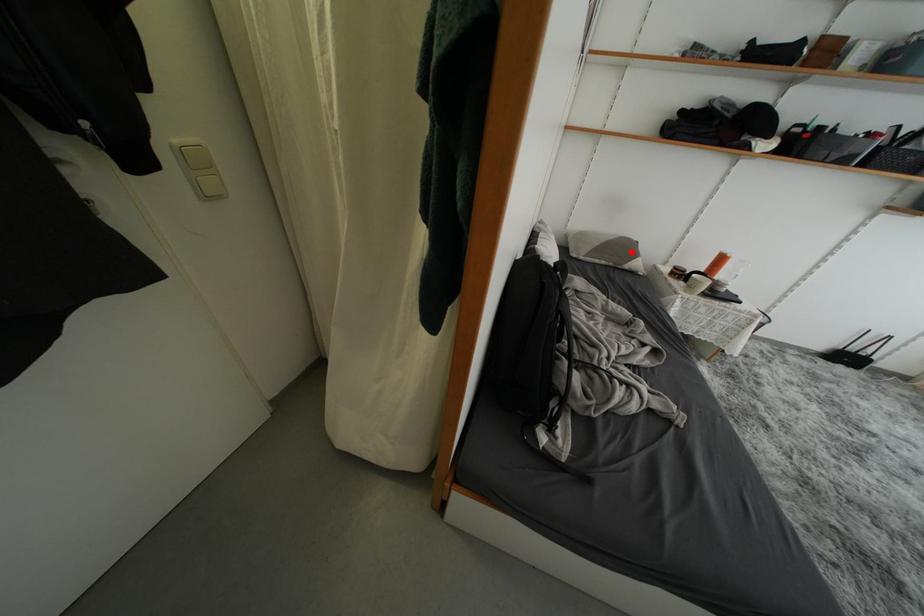
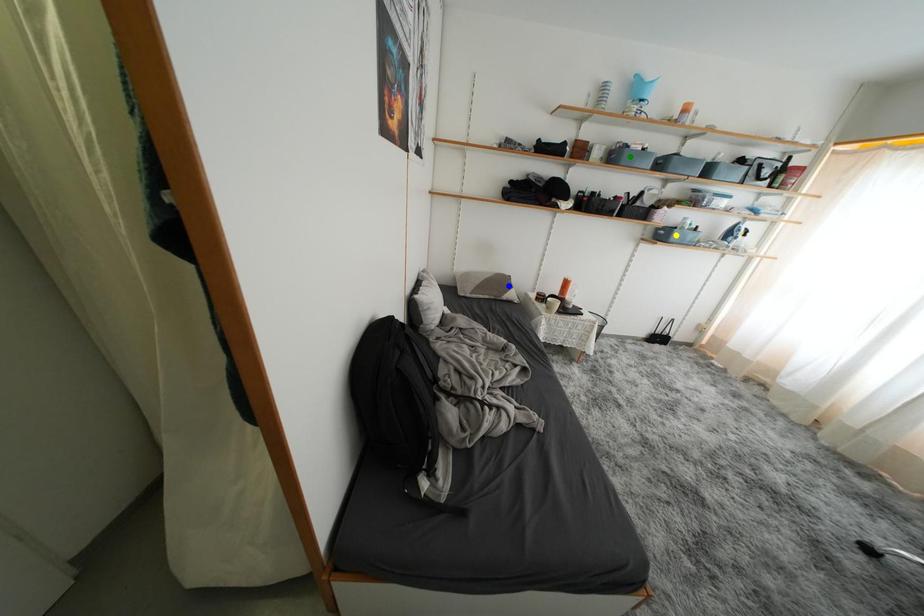
Question: I am providing you with two images of the same scene from different viewpoints. A red point is marked on the first image. You are given multiple points on the second image. Can you choose the point in image 2 that corresponds to the point in image 1?

Choices:
 (A) green point
 (B) blue point
 (C) yellow point

Answer: (B)